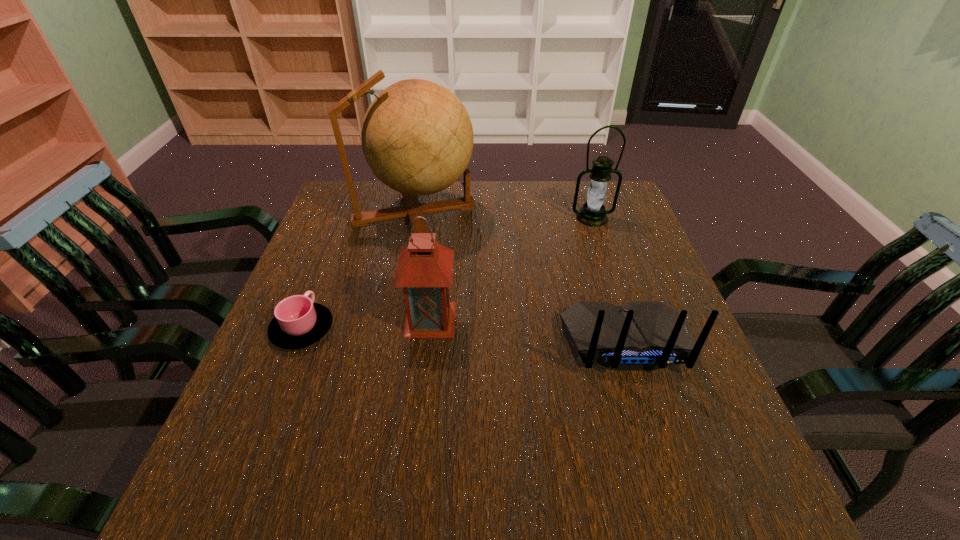
Where is `free space at the far edge of the desktop`? The width and height of the screenshot is (960, 540). free space at the far edge of the desktop is located at coordinates (538, 205).

The width and height of the screenshot is (960, 540). Identify the location of free location at the near edge. (575, 474).

In the image, there is a desktop. At what (x,y) coordinates should I click in order to perform the action: click on free space at the right edge. Please return your answer as a coordinate pair (x, y). Looking at the image, I should click on (695, 434).

In the image, there is a desktop. Identify the location of vacant space at the far left corner. Image resolution: width=960 pixels, height=540 pixels. (331, 201).

The height and width of the screenshot is (540, 960). What are the coordinates of `free point at the near right corner` in the screenshot? It's located at (694, 508).

Where is `free space that is in between the farther lantern and the globe`? free space that is in between the farther lantern and the globe is located at coordinates (503, 216).

At what (x,y) coordinates should I click in order to perform the action: click on unoccupied area between the router and the farther lantern. Please return your answer as a coordinate pair (x, y). The width and height of the screenshot is (960, 540). Looking at the image, I should click on (609, 280).

Where is `free space between the fourth tallest object and the right lantern`? This screenshot has width=960, height=540. free space between the fourth tallest object and the right lantern is located at coordinates (609, 280).

Identify the location of free space between the cup and the globe. (x=358, y=272).

Where is `vacant space in between the second shortest object and the farther lantern`? The image size is (960, 540). vacant space in between the second shortest object and the farther lantern is located at coordinates (609, 280).